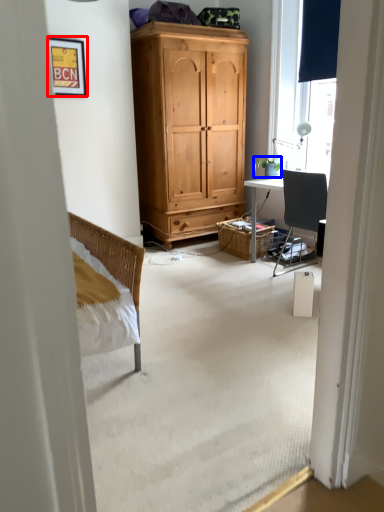
Question: Which object appears farthest to the camera in this image, picture frame (highlighted by a red box) or houseplant (highlighted by a blue box)?

Choices:
 (A) picture frame
 (B) houseplant

Answer: (B)